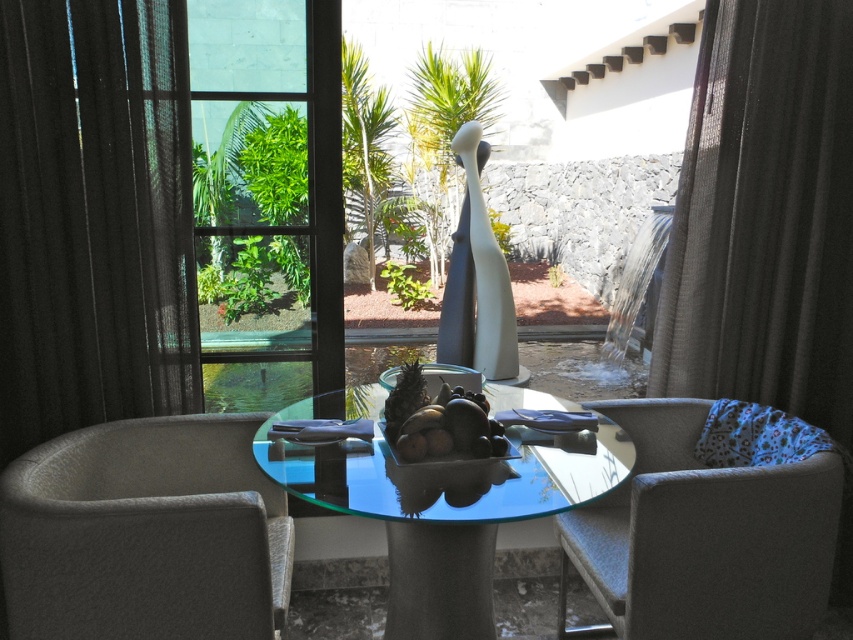
Question: Estimate the real-world distances between objects in this image. Which object is farther from the shiny brown fruit at center?

Choices:
 (A) textured gray armchair at lower right
 (B) black sheer curtain at right

Answer: (B)

Question: Is black sheer curtain at left smaller than transparent glass table at center?

Choices:
 (A) no
 (B) yes

Answer: (B)

Question: Is black sheer curtain at left thinner than textured gray armchair at lower left?

Choices:
 (A) no
 (B) yes

Answer: (B)

Question: Which point appears closest to the camera in this image?

Choices:
 (A) (312, 259)
 (B) (136, 476)
 (C) (726, 529)
 (D) (471, 442)

Answer: (D)

Question: Which point is farther from the camera taking this photo?

Choices:
 (A) pyautogui.click(x=468, y=540)
 (B) pyautogui.click(x=457, y=444)
 (C) pyautogui.click(x=283, y=310)
 (D) pyautogui.click(x=660, y=550)

Answer: (C)

Question: Is transparent glass table at center positioned in front of shiny brown fruit at center?

Choices:
 (A) no
 (B) yes

Answer: (B)